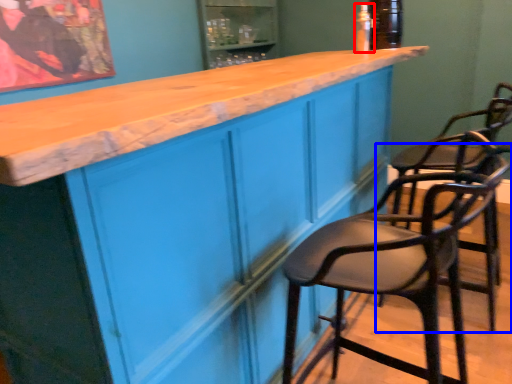
Question: Which point is further to the camera, bottle (highlighted by a red box) or chair (highlighted by a blue box)?

Choices:
 (A) bottle
 (B) chair

Answer: (A)